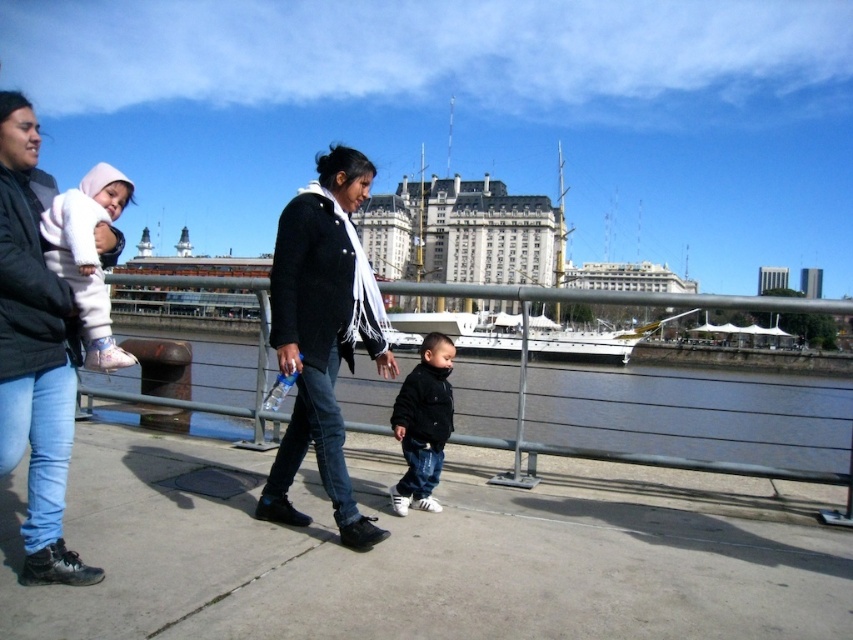
Question: Does concrete sidewalk at center appear on the right side of white fleece jacket at upper left?

Choices:
 (A) no
 (B) yes

Answer: (B)

Question: Which point is farther to the camera?

Choices:
 (A) black matte jacket at center
 (B) white fleece jacket at upper left
 (C) black woolen coat at center

Answer: (A)

Question: Which point is farther to the camera?

Choices:
 (A) (102, 349)
 (B) (360, 621)

Answer: (A)

Question: Observing the image, what is the correct spatial positioning of smooth concrete walkway at lower center in reference to matte black jacket at left?

Choices:
 (A) below
 (B) above

Answer: (A)

Question: Observing the image, what is the correct spatial positioning of concrete sidewalk at center in reference to white fleece jacket at upper left?

Choices:
 (A) below
 (B) above

Answer: (A)

Question: Among these objects, which one is farthest from the camera?

Choices:
 (A) black woolen coat at center
 (B) white fleece jacket at upper left
 (C) black matte jacket at center

Answer: (C)